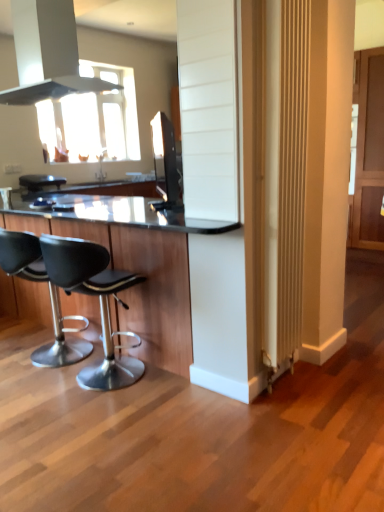
The height and width of the screenshot is (512, 384). In order to click on free point in front of black leather stool at lower left, the 2th chair positioned from the right in this screenshot , I will do `click(25, 401)`.